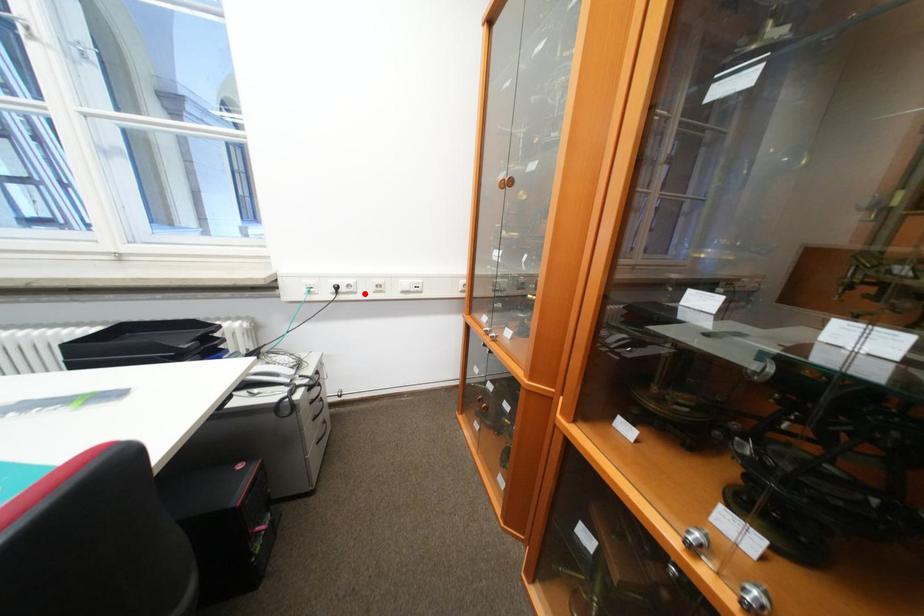
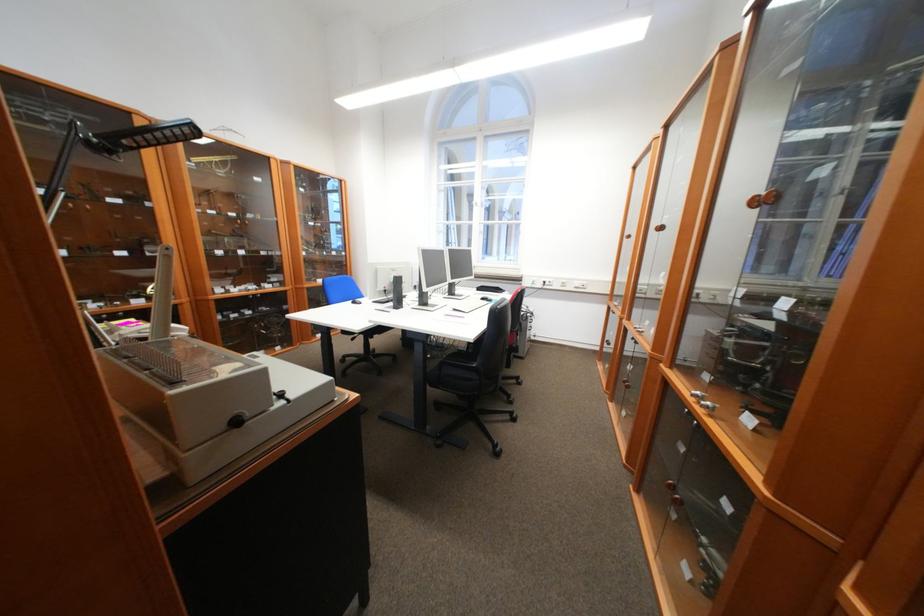
In the second image, find the point that corresponds to the highlighted location in the first image.

(562, 286)